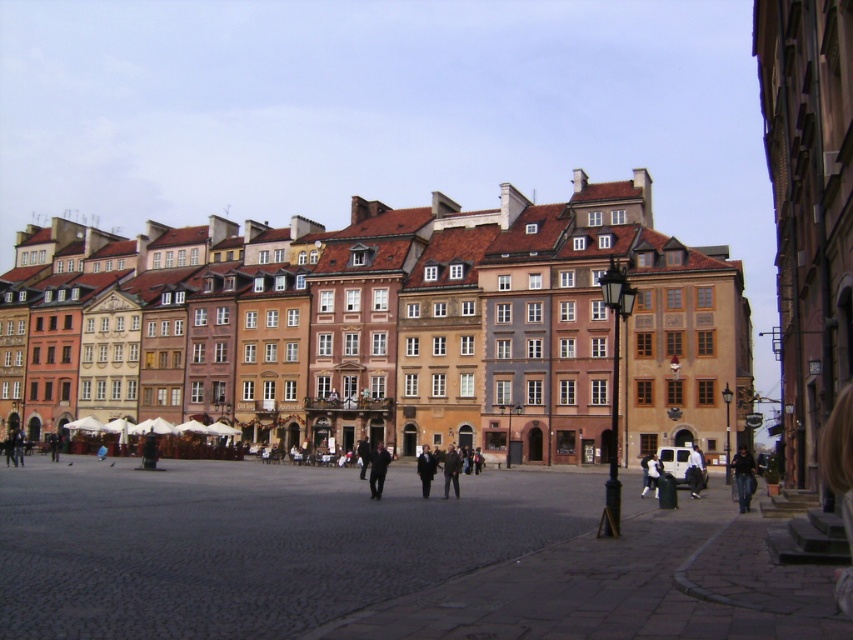
Question: Which point is farther from the camera taking this photo?

Choices:
 (A) (422, 493)
 (B) (746, 499)
 (C) (451, 468)

Answer: (A)

Question: Where is dark blue jeans at lower right located in relation to white cotton shirt at lower right in the image?

Choices:
 (A) above
 (B) below

Answer: (A)

Question: Does dark blue jeans at lower right lie in front of dark blue jacket at center?

Choices:
 (A) no
 (B) yes

Answer: (B)

Question: Which point is farther from the camera taking this photo?

Choices:
 (A) (456, 467)
 (B) (738, 500)
 (C) (369, 472)

Answer: (C)

Question: Considering the real-world distances, which object is closest to the matte brown building at center?

Choices:
 (A) dark blue jeans at lower right
 (B) dark gray jacket at center
 (C) dark gray suit at center

Answer: (C)

Question: Is dark blue jacket at center behind white cotton shirt at lower right?

Choices:
 (A) yes
 (B) no

Answer: (B)